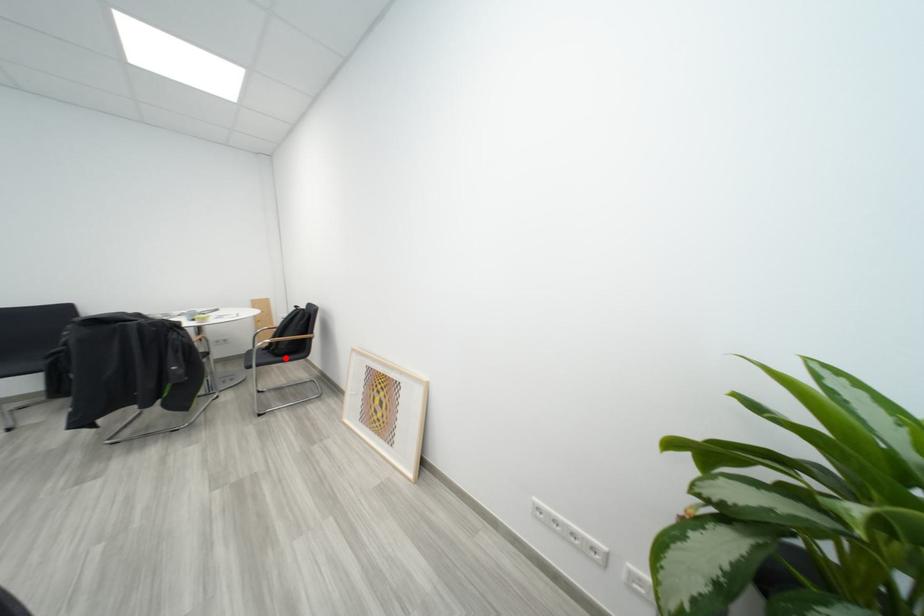
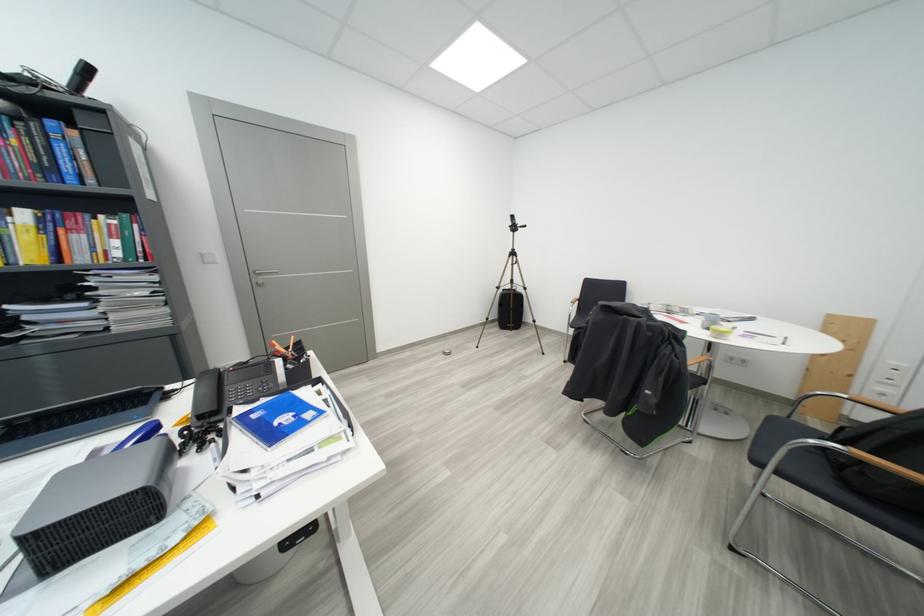
Question: I am providing you with two images of the same scene from different viewpoints. A red point is shown in image1. For the corresponding object point in image2, is it positioned nearer or farther from the camera?

Choices:
 (A) Nearer
 (B) Farther

Answer: (A)